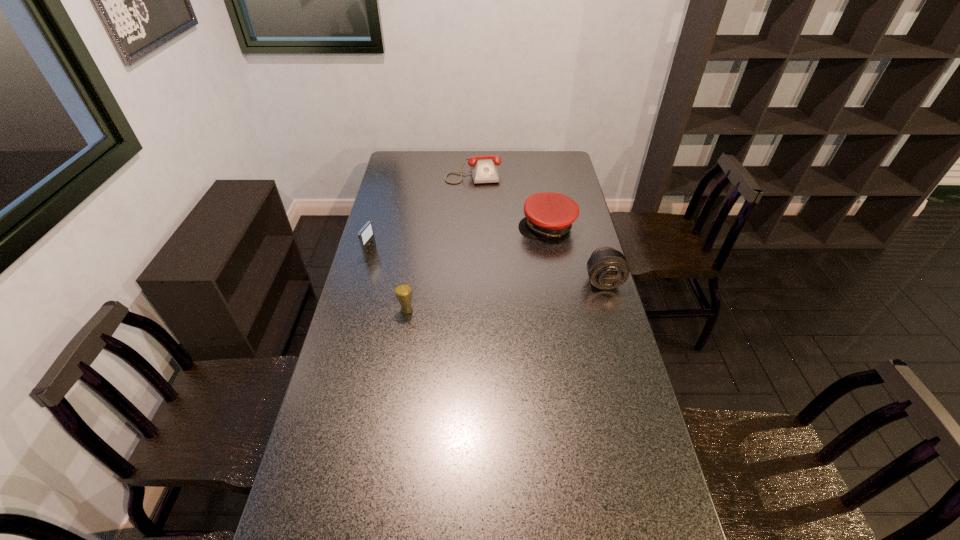
What are the coordinates of `free space between the telephone and the cap` in the screenshot? It's located at (510, 200).

The image size is (960, 540). I want to click on empty location between the leftmost object and the straw for drinking, so coord(389,283).

Locate an element on the screen. The image size is (960, 540). free spot between the leftmost object and the second shortest object is located at coordinates pyautogui.click(x=459, y=241).

The width and height of the screenshot is (960, 540). Find the location of `free space between the telephone and the iPod`. free space between the telephone and the iPod is located at coordinates (422, 214).

You are a GUI agent. You are given a task and a screenshot of the screen. Output one action in this format:
    pyautogui.click(x=<x>, y=<y>)
    Task: Click on the free space between the leftmost object and the cap
    The height and width of the screenshot is (540, 960).
    Given the screenshot: What is the action you would take?
    pyautogui.click(x=459, y=241)

The image size is (960, 540). Find the location of `vacant space that's between the telephone and the cap`. vacant space that's between the telephone and the cap is located at coordinates (510, 200).

This screenshot has width=960, height=540. Identify the location of vacant region between the straw for drinking and the leftmost object. (389, 283).

Locate an element on the screen. Image resolution: width=960 pixels, height=540 pixels. empty space that is in between the leftmost object and the telephoto lens is located at coordinates (487, 268).

Locate an element on the screen. Image resolution: width=960 pixels, height=540 pixels. free space between the iPod and the second object from left to right is located at coordinates (389, 283).

The image size is (960, 540). Identify the location of free space between the second nearest object and the second object from left to right. (505, 296).